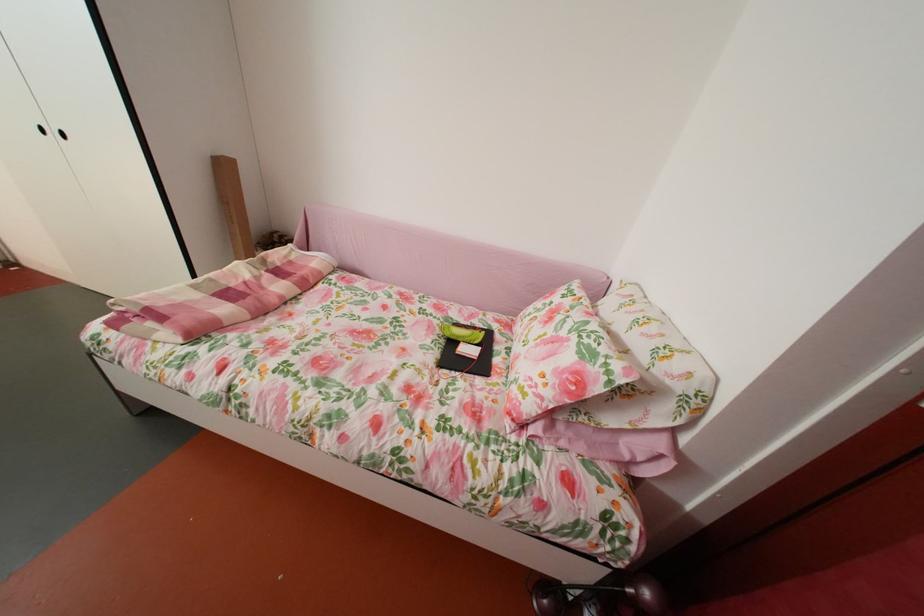
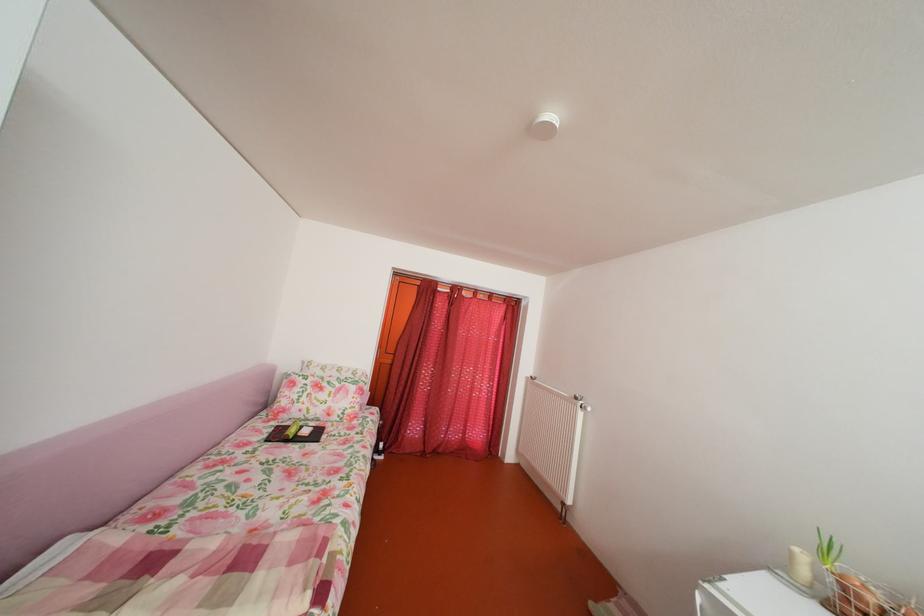
Locate, in the second image, the point that corresponds to [506,333] in the first image.

(286, 430)